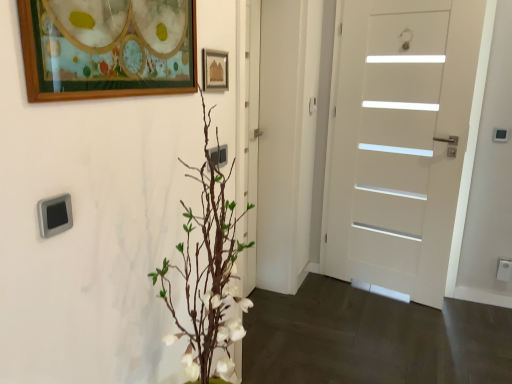
Question: Does white matte door at right have a greater height compared to white plastic electric outlet at lower right, which is the second electric outlet from top to bottom?

Choices:
 (A) yes
 (B) no

Answer: (A)

Question: From the image's perspective, is white matte door at right located above white plastic electric outlet at lower right, the second electric outlet from the left?

Choices:
 (A) no
 (B) yes

Answer: (B)

Question: Would you say white matte door at right is outside white plastic electric outlet at lower right, which is the first electric outlet from back to front?

Choices:
 (A) yes
 (B) no

Answer: (A)

Question: Considering the relative positions of white matte door at right and white plastic electric outlet at lower right, the first electric outlet from the bottom, in the image provided, is white matte door at right to the left of white plastic electric outlet at lower right, the first electric outlet from the bottom, from the viewer's perspective?

Choices:
 (A) no
 (B) yes

Answer: (B)

Question: Is white matte door at right with white plastic electric outlet at lower right, the second electric outlet from the left?

Choices:
 (A) no
 (B) yes

Answer: (A)

Question: Does white matte door at right lie behind white plastic electric outlet at lower right, the second electric outlet from the left?

Choices:
 (A) yes
 (B) no

Answer: (B)

Question: From a real-world perspective, is white plastic electric outlet at lower right, which is the second electric outlet from top to bottom, located higher than satin silver switch at upper left?

Choices:
 (A) no
 (B) yes

Answer: (A)

Question: Can you confirm if white plastic electric outlet at lower right, placed as the second electric outlet when sorted from front to back, is smaller than satin silver switch at upper left?

Choices:
 (A) no
 (B) yes

Answer: (A)

Question: Can satin silver switch at upper left be found inside white plastic electric outlet at lower right, the second electric outlet from the left?

Choices:
 (A) no
 (B) yes

Answer: (A)

Question: Considering the relative sizes of white plastic electric outlet at lower right, the first electric outlet from the bottom, and satin silver switch at upper left in the image provided, is white plastic electric outlet at lower right, the first electric outlet from the bottom, bigger than satin silver switch at upper left?

Choices:
 (A) yes
 (B) no

Answer: (A)

Question: Does white plastic electric outlet at lower right, the second electric outlet from the left, have a greater height compared to satin silver switch at upper left?

Choices:
 (A) yes
 (B) no

Answer: (A)

Question: From the image's perspective, is white plastic electric outlet at lower right, the first electric outlet from the bottom, located beneath satin silver switch at upper left?

Choices:
 (A) no
 (B) yes

Answer: (B)

Question: Is wooden picture frame at upper left, the 2th picture frame when ordered from back to front, at the right side of wooden picture frame at upper center, the first picture frame when ordered from right to left?

Choices:
 (A) yes
 (B) no

Answer: (B)